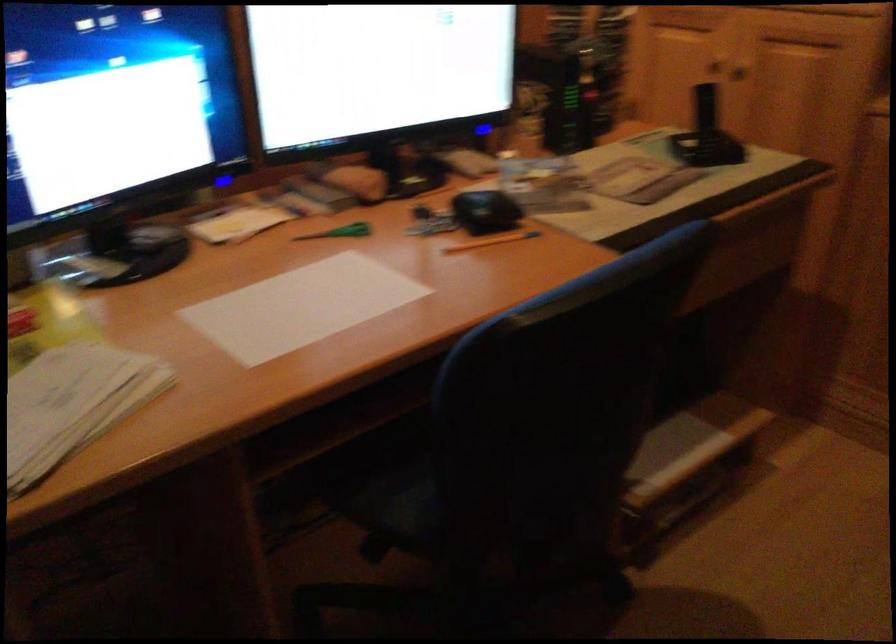
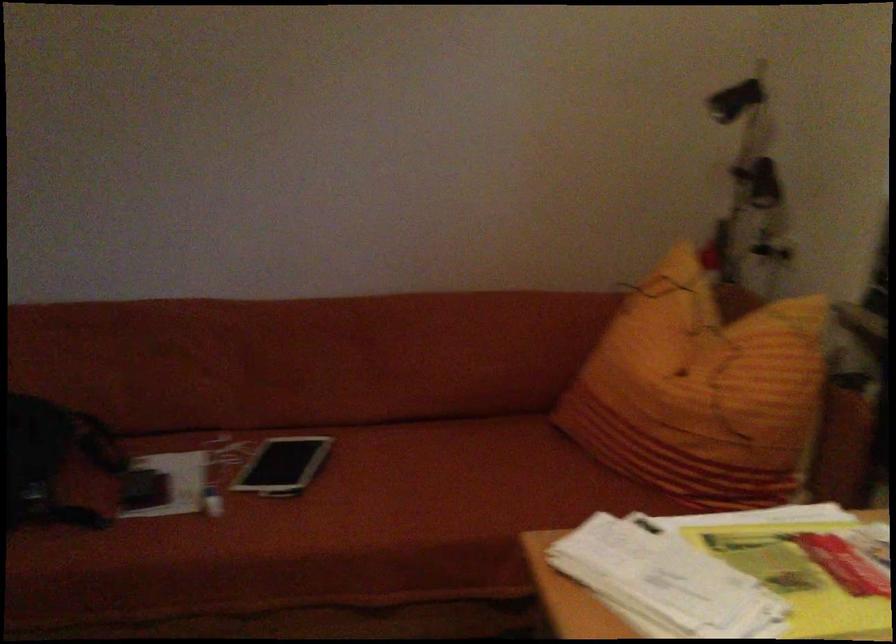
The images are taken continuously from a first-person perspective. In which direction is your viewpoint rotating?

The camera's rotation is toward left-down.